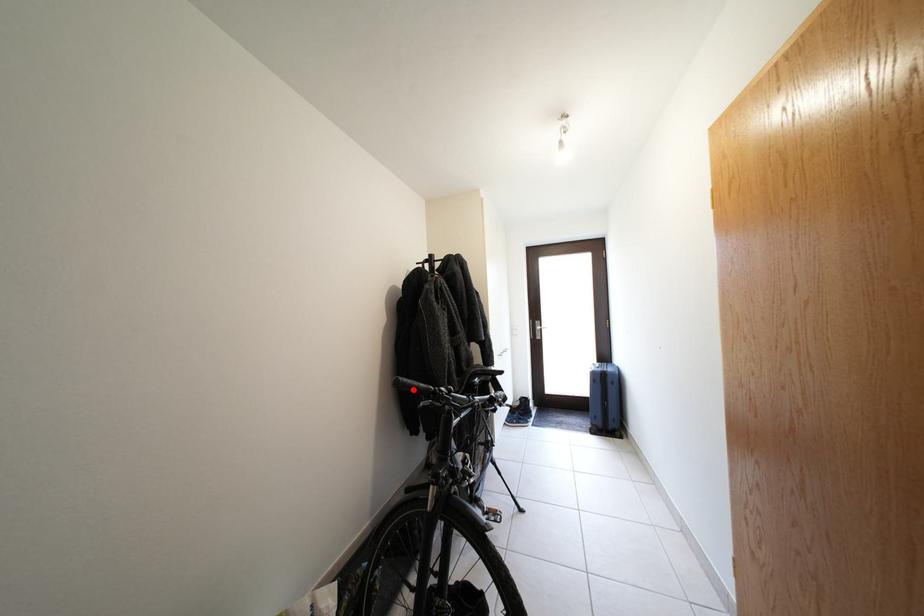
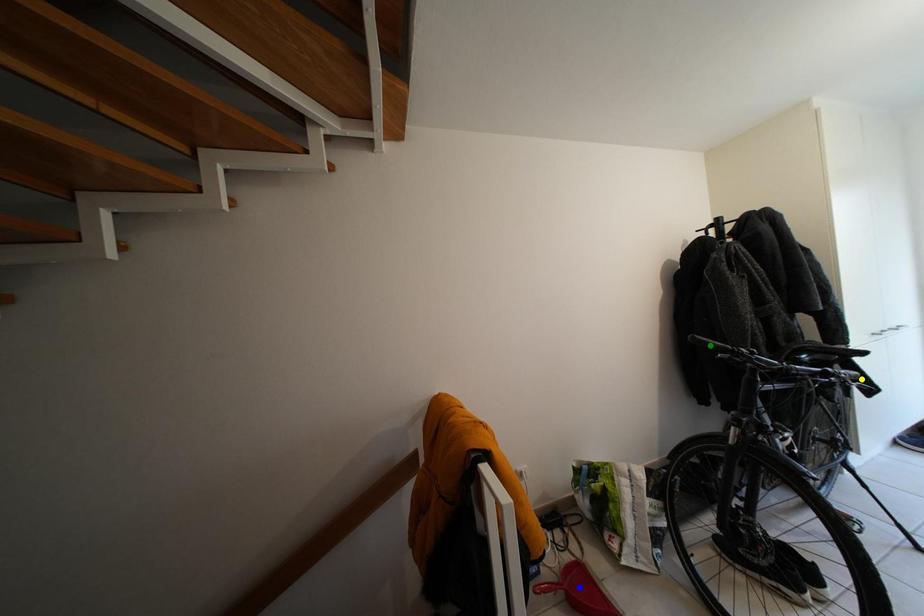
Question: I am providing you with two images of the same scene from different viewpoints. A red point is marked on the first image. You are given multiple points on the second image. Can you choose the point in image 2 that corresponds to the point in image 1?

Choices:
 (A) blue point
 (B) yellow point
 (C) green point

Answer: (C)